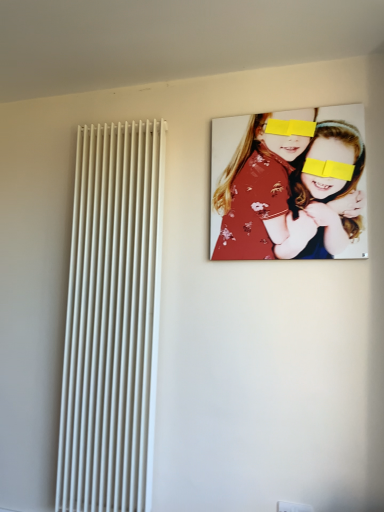
What do you see at coordinates (294, 188) in the screenshot? I see `floral fabric portrait at upper right` at bounding box center [294, 188].

In order to click on floral fabric portrait at upper right in this screenshot , I will do `click(294, 188)`.

Describe the element at coordinates (112, 320) in the screenshot. I see `white smooth radiator at left` at that location.

Identify the location of white smooth radiator at left. The image size is (384, 512). (112, 320).

What is the approximate width of white smooth radiator at left?

white smooth radiator at left is 6.82 inches wide.

This screenshot has width=384, height=512. What are the coordinates of `floral fabric portrait at upper right` in the screenshot? It's located at (294, 188).

Does white smooth radiator at left appear on the left side of floral fabric portrait at upper right?

Correct, you'll find white smooth radiator at left to the left of floral fabric portrait at upper right.

Between white smooth radiator at left and floral fabric portrait at upper right, which one is positioned behind?

white smooth radiator at left is further away from the camera.

Between point (139, 505) and point (310, 220), which one is positioned behind?

Positioned behind is point (139, 505).

From the image's perspective, between white smooth radiator at left and floral fabric portrait at upper right, which one is located above?

floral fabric portrait at upper right.

From a real-world perspective, which is physically below, white smooth radiator at left or floral fabric portrait at upper right?

From a 3D spatial view, white smooth radiator at left is below.

Does white smooth radiator at left have a lesser width compared to floral fabric portrait at upper right?

No.

Considering the sizes of objects white smooth radiator at left and floral fabric portrait at upper right in the image provided, who is taller, white smooth radiator at left or floral fabric portrait at upper right?

white smooth radiator at left is taller.

Does white smooth radiator at left have a larger size compared to floral fabric portrait at upper right?

Yes, white smooth radiator at left is bigger than floral fabric portrait at upper right.

Is white smooth radiator at left not inside floral fabric portrait at upper right?

white smooth radiator at left lies outside floral fabric portrait at upper right's area.

Are white smooth radiator at left and floral fabric portrait at upper right far apart?

No, there isn't a large distance between white smooth radiator at left and floral fabric portrait at upper right.

Is white smooth radiator at left positioned with its back to floral fabric portrait at upper right?

white smooth radiator at left is not turned away from floral fabric portrait at upper right.

Image resolution: width=384 pixels, height=512 pixels. Identify the location of girl above the white smooth radiator at left (from a real-world perspective). (294, 188).

Is floral fabric portrait at upper right to the left or to the right of white smooth radiator at left in the image?

Based on their positions, floral fabric portrait at upper right is located to the right of white smooth radiator at left.

Which object is further away from the camera, floral fabric portrait at upper right or white smooth radiator at left?

white smooth radiator at left is more distant.

Is point (305, 127) more distant than point (107, 395)?

No.

From the image's perspective, relative to white smooth radiator at left, is floral fabric portrait at upper right above or below?

floral fabric portrait at upper right is above white smooth radiator at left.

From a real-world perspective, which object stands above the other?

floral fabric portrait at upper right is physically above.

Does floral fabric portrait at upper right have a greater width compared to white smooth radiator at left?

Incorrect, the width of floral fabric portrait at upper right does not surpass that of white smooth radiator at left.

Does floral fabric portrait at upper right have a lesser height compared to white smooth radiator at left?

Correct, floral fabric portrait at upper right is not as tall as white smooth radiator at left.

Which of these two, floral fabric portrait at upper right or white smooth radiator at left, is bigger?

With larger size is white smooth radiator at left.

Is white smooth radiator at left completely or partially inside floral fabric portrait at upper right?

No, floral fabric portrait at upper right does not contain white smooth radiator at left.

Is there a large distance between floral fabric portrait at upper right and white smooth radiator at left?

They are positioned close to each other.

Looking at this image, is floral fabric portrait at upper right positioned with its back to white smooth radiator at left?

No, floral fabric portrait at upper right is not facing away from white smooth radiator at left.

Can you tell me how much floral fabric portrait at upper right and white smooth radiator at left differ in facing direction?

The angular difference between floral fabric portrait at upper right and white smooth radiator at left is 0.153 degrees.

Where is `girl to the right of white smooth radiator at left`? girl to the right of white smooth radiator at left is located at coordinates (294, 188).

Find the location of a particular element. girl on the right of white smooth radiator at left is located at coordinates (294, 188).

Find the location of a particular element. radiator on the left of floral fabric portrait at upper right is located at coordinates (112, 320).